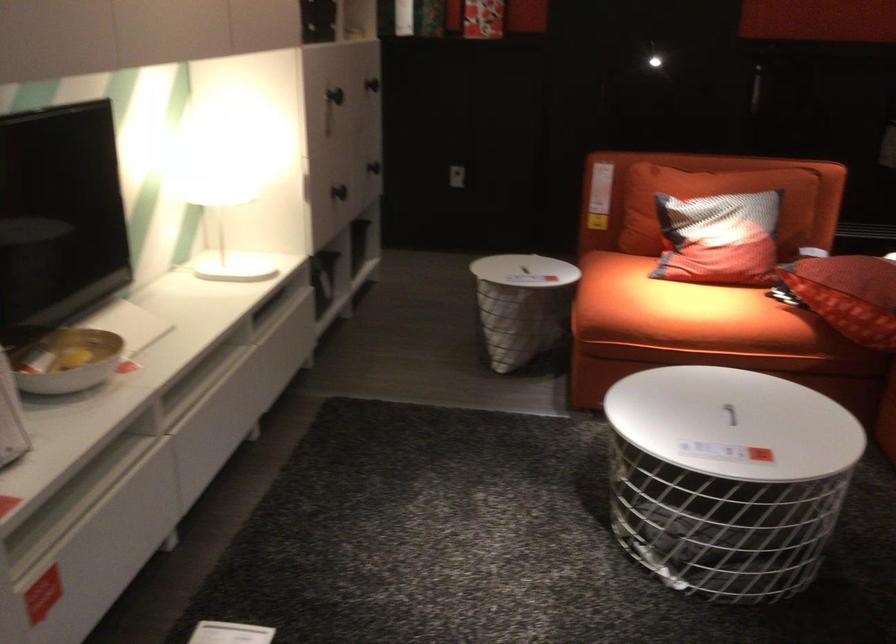
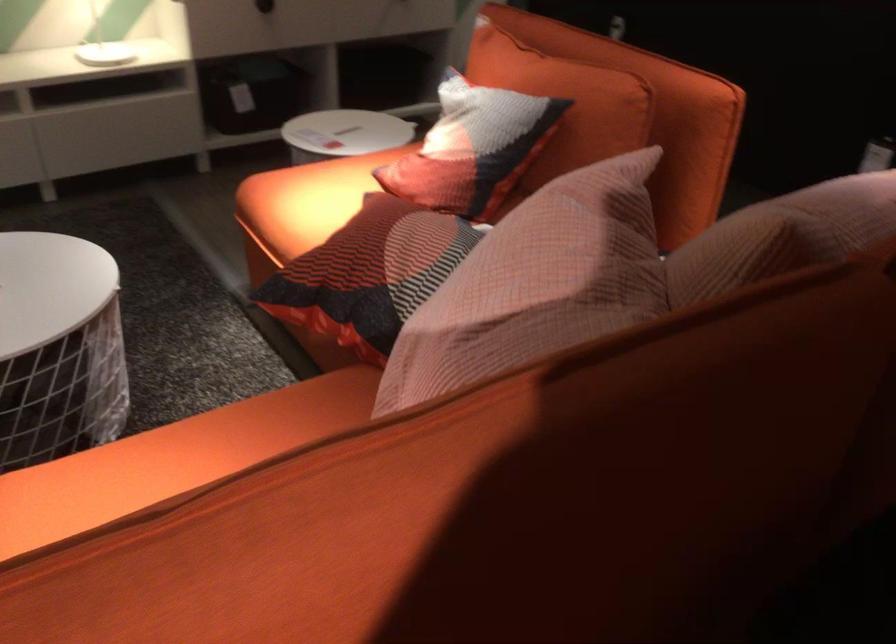
Find the pixel in the second image that matches (771,222) in the first image.

(472, 147)